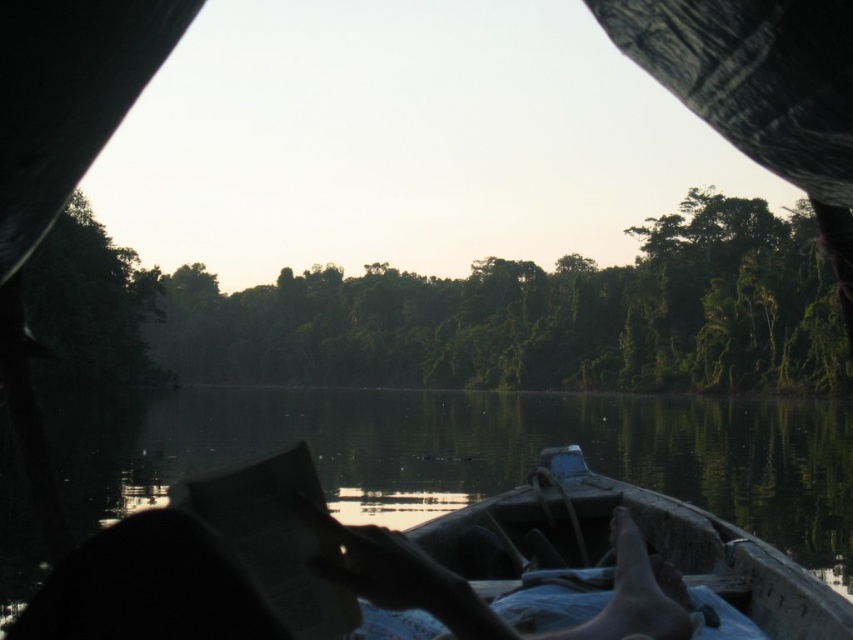
Between transparent water at center and wooden canoe at center, which one appears on the left side from the viewer's perspective?

wooden canoe at center

Is transparent water at center bigger than wooden canoe at center?

Yes.

I want to click on transparent water at center, so click(x=480, y=451).

Does transparent water at center have a greater height compared to dark skin at lower center?

Correct, transparent water at center is much taller as dark skin at lower center.

This screenshot has height=640, width=853. Find the location of `transparent water at center`. transparent water at center is located at coordinates (480, 451).

Where is `transparent water at center`? The width and height of the screenshot is (853, 640). transparent water at center is located at coordinates tap(480, 451).

Which of these two, dark skin at lower center or wooden canoe at center, stands shorter?

Standing shorter between the two is dark skin at lower center.

Does dark skin at lower center have a lesser height compared to wooden canoe at center?

Correct, dark skin at lower center is not as tall as wooden canoe at center.

Is point (131, 568) positioned before point (784, 570)?

Yes, point (131, 568) is closer to viewer.

The image size is (853, 640). What are the coordinates of `dark skin at lower center` in the screenshot? It's located at (148, 588).